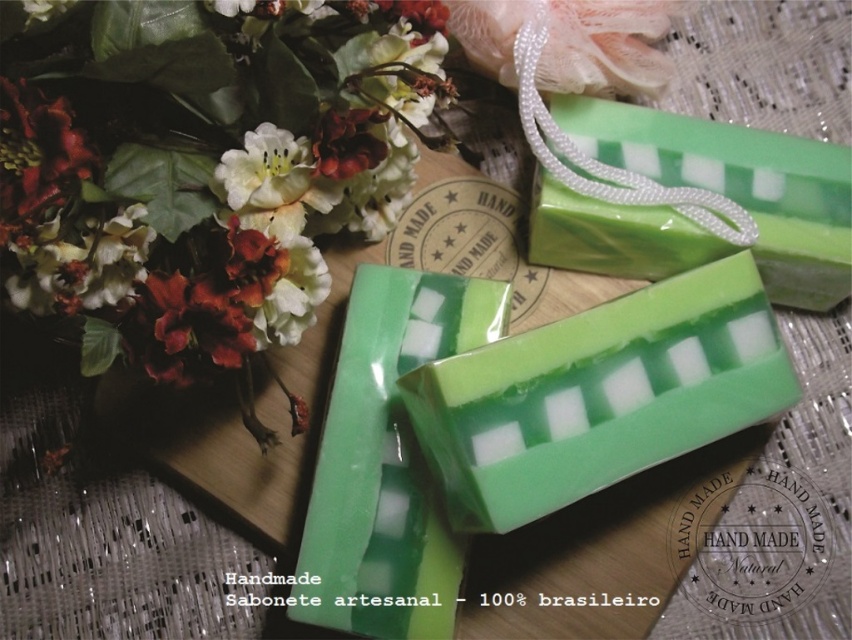
Looking at this image, you are organizing a gift basket and need to choose between the green translucent soap at center and the green matte soap at upper right. Which soap should you pick if you want the one that takes up more space?

The green translucent soap at center is larger in size compared to the green matte soap at upper right, so it would take up more space and should be chosen.

You are a customer in a gift shop and want to buy the matte floral bouquet at upper left. The shop requires you to specify its exact location in the image. What coordinates should you provide?

The matte floral bouquet at upper left is located at coordinates point (202, 164).

You are arranging a gift basket and need to place the matte floral bouquet at upper left and the green matte soap at upper right. Based on their positions in the image, which item should you place first if you want to follow the same left to right layout?

You should place the matte floral bouquet at upper left first because it is positioned to the left of the green matte soap at upper right in the image.